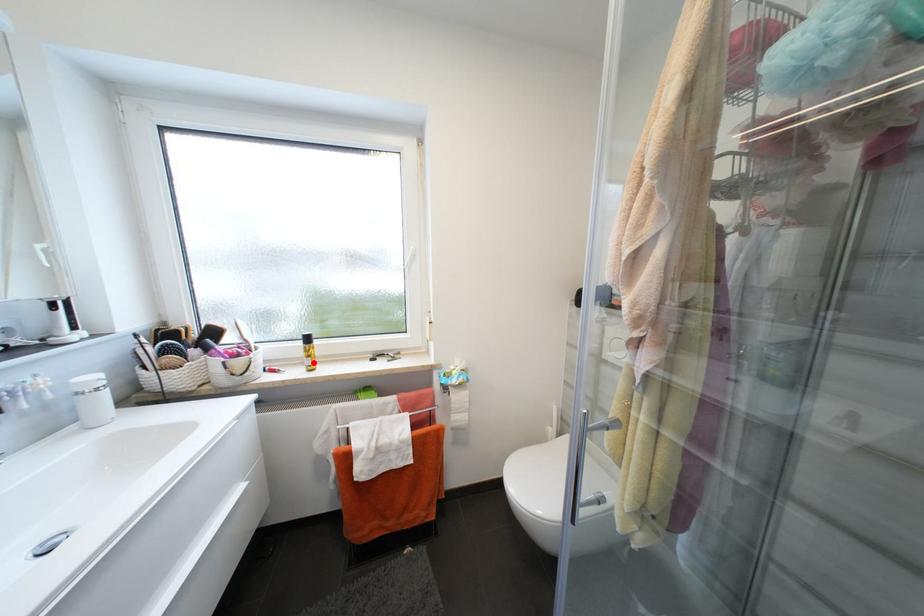
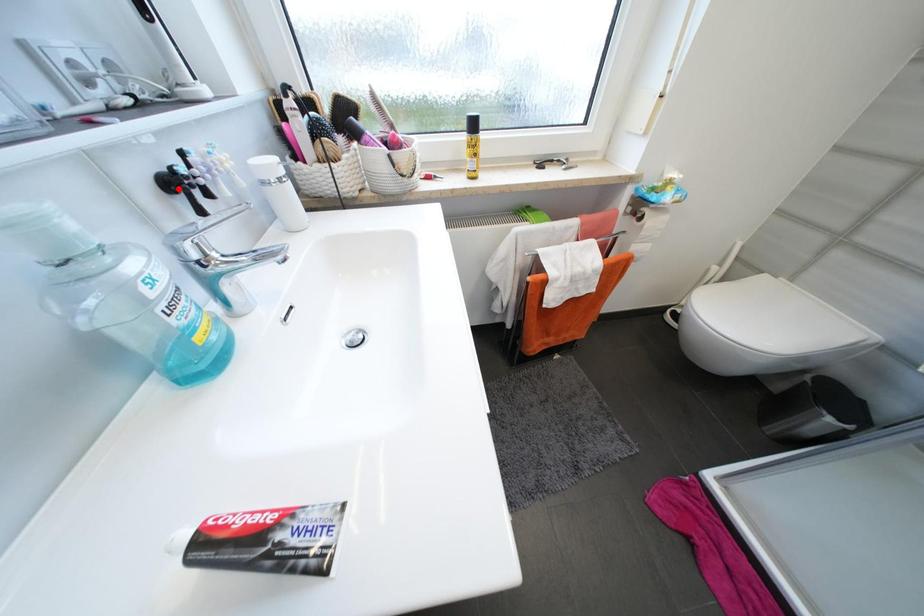
I am providing you with two images of the same scene from different viewpoints. A red point is marked on the first image and another point is marked on the second image. Do the highlighted points in image1 and image2 indicate the same real-world spot?

No